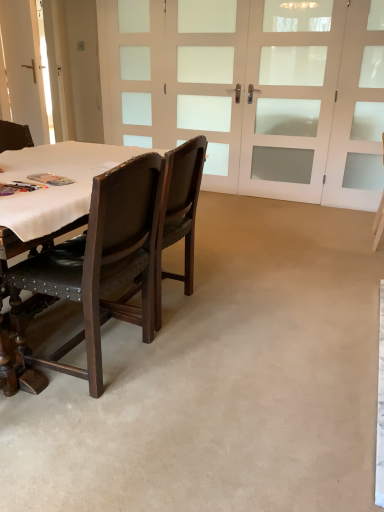
Question: From the image's perspective, is white frosted glass screen door at upper right, marked as the 1th screen door in a right-to-left arrangement, positioned above or below brown leather chair at center, which is the 2th chair from right to left?

Choices:
 (A) below
 (B) above

Answer: (B)

Question: Choose the correct answer: Is white frosted glass screen door at upper right, acting as the 3th screen door starting from the left, inside brown leather chair at center, positioned as the 2th chair in left-to-right order, or outside it?

Choices:
 (A) outside
 (B) inside

Answer: (A)

Question: Which of these objects is positioned closest to the white fabric table at left?

Choices:
 (A) brown leather chair at center, the 2th chair viewed from the front
 (B) matte plastic book at table left
 (C) white leather chair at right, the first chair when ordered from right to left
 (D) white glass doors at upper center, arranged as the 2th screen door when viewed from the left
 (E) leather at left, the 1th chair in the front-to-back sequence

Answer: (B)

Question: Which object is the farthest from the white glass doors at center, which is the first screen door in left-to-right order?

Choices:
 (A) white leather chair at right, the third chair from the left
 (B) matte plastic book at table left
 (C) white glass doors at upper center, arranged as the second screen door when viewed from the right
 (D) leather at left, the 1th chair in the front-to-back sequence
 (E) brown leather chair at center, positioned as the 2th chair in left-to-right order

Answer: (B)